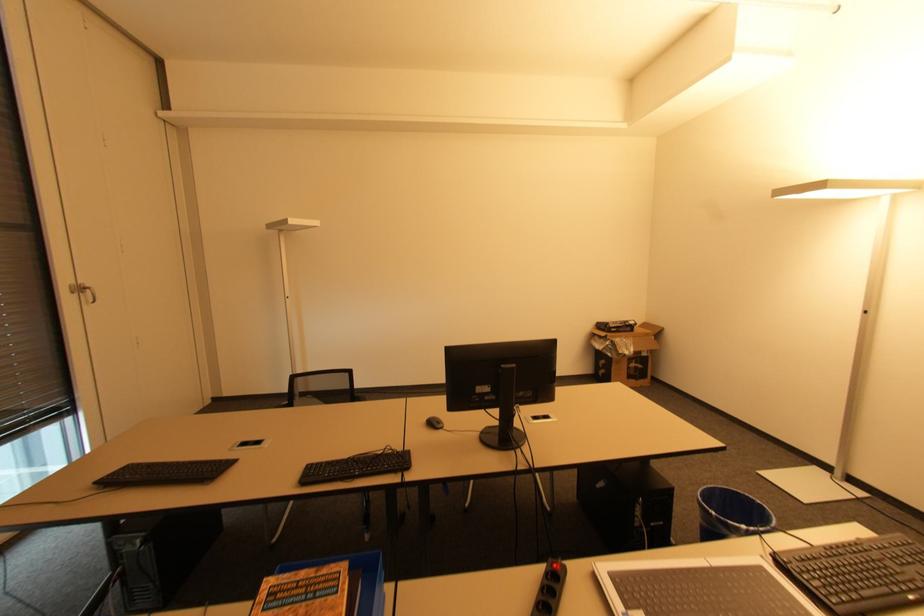
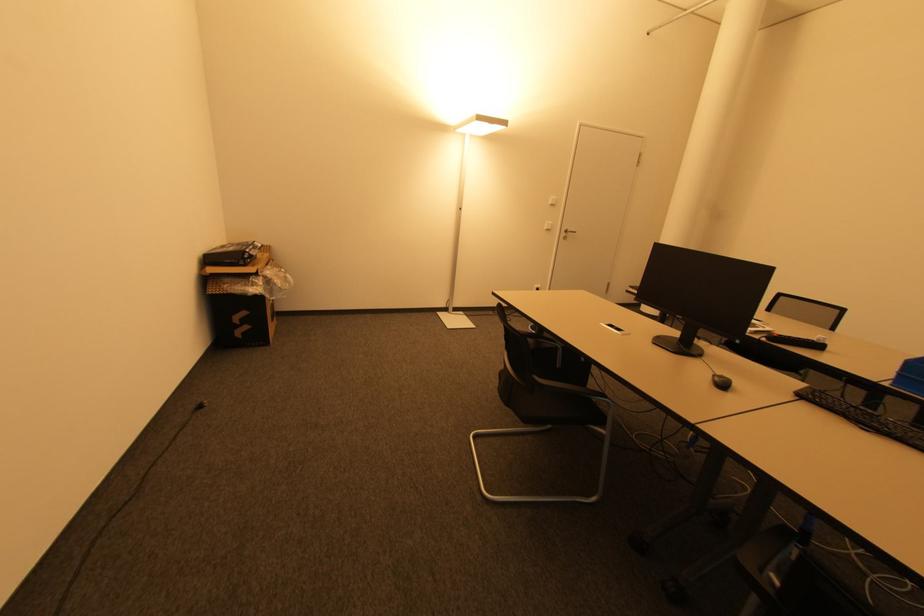
The point at [635,365] is marked in the first image. Where is the corresponding point in the second image?

(273, 302)